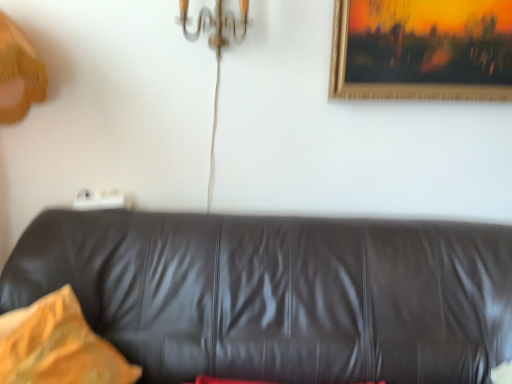
Where is `yellow fabric pillow at left`? Image resolution: width=512 pixels, height=384 pixels. yellow fabric pillow at left is located at coordinates (58, 346).

Identify the location of black leather couch at center. This screenshot has width=512, height=384. (278, 294).

Is black leather couch at center far away from yellow fabric pillow at left?

No, black leather couch at center is in close proximity to yellow fabric pillow at left.

From a real-world perspective, is black leather couch at center beneath yellow fabric pillow at left?

Yes, from a real-world perspective, black leather couch at center is under yellow fabric pillow at left.

Looking at this image, which is behind, black leather couch at center or yellow fabric pillow at left?

yellow fabric pillow at left is more distant.

Is black leather couch at center positioned with its back to yellow fabric pillow at left?

That's right, black leather couch at center is facing away from yellow fabric pillow at left.

From a real-world perspective, between black leather couch at center and gold-framed painting at upper right, who is vertically lower?

black leather couch at center is physically lower.

Which is more to the left, black leather couch at center or gold-framed painting at upper right?

black leather couch at center.

From the image's perspective, is black leather couch at center beneath gold-framed painting at upper right?

Indeed, from the image's perspective, black leather couch at center is shown beneath gold-framed painting at upper right.

Is the depth of black leather couch at center less than that of gold-framed painting at upper right?

Yes, it is in front of gold-framed painting at upper right.

Is gold-framed painting at upper right positioned with its back to yellow fabric pillow at left?

gold-framed painting at upper right does not have its back to yellow fabric pillow at left.

From the image's perspective, which is below, gold-framed painting at upper right or yellow fabric pillow at left?

yellow fabric pillow at left appears lower in the image.

Do you think gold-framed painting at upper right is within yellow fabric pillow at left, or outside of it?

gold-framed painting at upper right lies outside yellow fabric pillow at left.

Does gold-framed painting at upper right appear on the right side of yellow fabric pillow at left?

Indeed, gold-framed painting at upper right is positioned on the right side of yellow fabric pillow at left.

Who is taller, yellow fabric pillow at left or gold-framed painting at upper right?

With more height is yellow fabric pillow at left.

Consider the image. From a real-world perspective, is yellow fabric pillow at left located beneath gold-framed painting at upper right?

Indeed, from a real-world perspective, yellow fabric pillow at left is positioned beneath gold-framed painting at upper right.

Which point is more distant from viewer, (20, 312) or (462, 11)?

Positioned behind is point (462, 11).

In terms of width, does yellow fabric pillow at left look wider or thinner when compared to gold-framed painting at upper right?

yellow fabric pillow at left is wider than gold-framed painting at upper right.

From a real-world perspective, is gold-framed painting at upper right above or below black leather couch at center?

gold-framed painting at upper right is situated higher than black leather couch at center in the real world.

Is gold-framed painting at upper right turned away from black leather couch at center?

No, black leather couch at center is not at the back of gold-framed painting at upper right.

Considering the relative sizes of gold-framed painting at upper right and black leather couch at center in the image provided, is gold-framed painting at upper right bigger than black leather couch at center?

Actually, gold-framed painting at upper right might be smaller than black leather couch at center.

Does point (358, 9) come closer to viewer compared to point (335, 297)?

No, (358, 9) is further to viewer.

Are yellow fabric pillow at left and black leather couch at center beside each other?

yellow fabric pillow at left and black leather couch at center are clearly separated.

From the image's perspective, would you say yellow fabric pillow at left is shown under black leather couch at center?

No.

From a real-world perspective, is yellow fabric pillow at left physically located above or below black leather couch at center?

yellow fabric pillow at left is situated higher than black leather couch at center in the real world.

In the scene shown: Could you tell me if yellow fabric pillow at left is turned towards black leather couch at center?

Yes, yellow fabric pillow at left is oriented towards black leather couch at center.

This screenshot has width=512, height=384. I want to click on studio couch below the yellow fabric pillow at left (from a real-world perspective), so pos(278,294).

This screenshot has height=384, width=512. In order to click on studio couch that is below the gold-framed painting at upper right (from the image's perspective) in this screenshot , I will do `click(278, 294)`.

From the image, which object appears to be farther from yellow fabric pillow at left, gold-framed painting at upper right or black leather couch at center?

gold-framed painting at upper right lies further to yellow fabric pillow at left than the other object.

Estimate the real-world distances between objects in this image. Which object is closer to yellow fabric pillow at left, black leather couch at center or gold-framed painting at upper right?

black leather couch at center is closer to yellow fabric pillow at left.

When comparing their distances from gold-framed painting at upper right, does black leather couch at center or yellow fabric pillow at left seem further?

yellow fabric pillow at left is positioned further to the anchor gold-framed painting at upper right.

When comparing their distances from black leather couch at center, does gold-framed painting at upper right or yellow fabric pillow at left seem closer?

yellow fabric pillow at left is closer to black leather couch at center.

When comparing their distances from black leather couch at center, does yellow fabric pillow at left or gold-framed painting at upper right seem further?

Among the two, gold-framed painting at upper right is located further to black leather couch at center.

Considering their positions, is yellow fabric pillow at left positioned closer to gold-framed painting at upper right than black leather couch at center?

black leather couch at center lies closer to gold-framed painting at upper right than the other object.

This screenshot has width=512, height=384. Identify the location of studio couch between yellow fabric pillow at left and gold-framed painting at upper right from left to right. (278, 294).